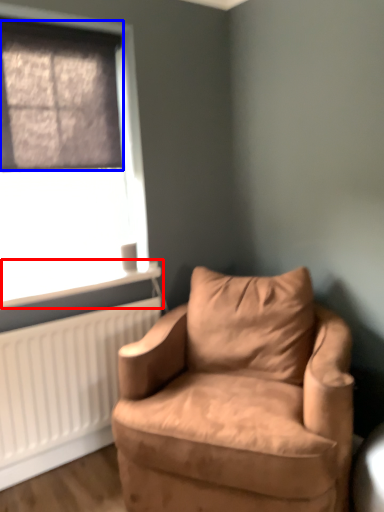
Question: Which object is closer to the camera taking this photo, window sill (highlighted by a red box) or window screen (highlighted by a blue box)?

Choices:
 (A) window sill
 (B) window screen

Answer: (B)